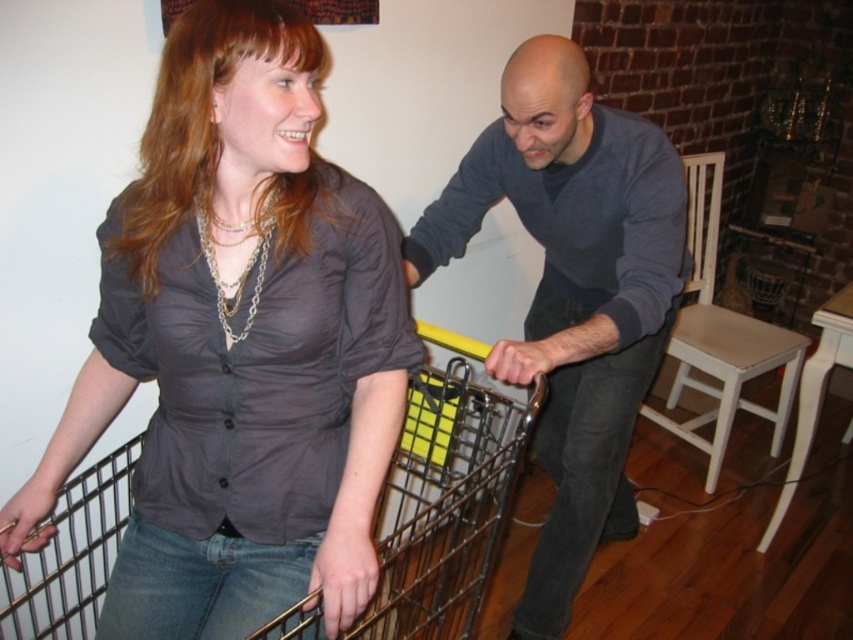
Question: Which object is the closest to the matte gray sweater at center?

Choices:
 (A) white wood stool at right
 (B) matte gray shirt at center

Answer: (B)

Question: Observing the image, what is the correct spatial positioning of matte gray sweater at center in reference to white wood stool at right?

Choices:
 (A) below
 (B) above

Answer: (B)

Question: Which point is closer to the camera?

Choices:
 (A) (445, 472)
 (B) (230, 616)
 (C) (666, 276)
 (D) (733, 330)

Answer: (B)

Question: Is matte gray shirt at center above white wood stool at right?

Choices:
 (A) no
 (B) yes

Answer: (B)

Question: Which object appears farthest from the camera in this image?

Choices:
 (A) matte gray shirt at center
 (B) white wood stool at right

Answer: (B)

Question: Does metallic wire trolley at center appear on the right side of white wood stool at right?

Choices:
 (A) yes
 (B) no

Answer: (B)